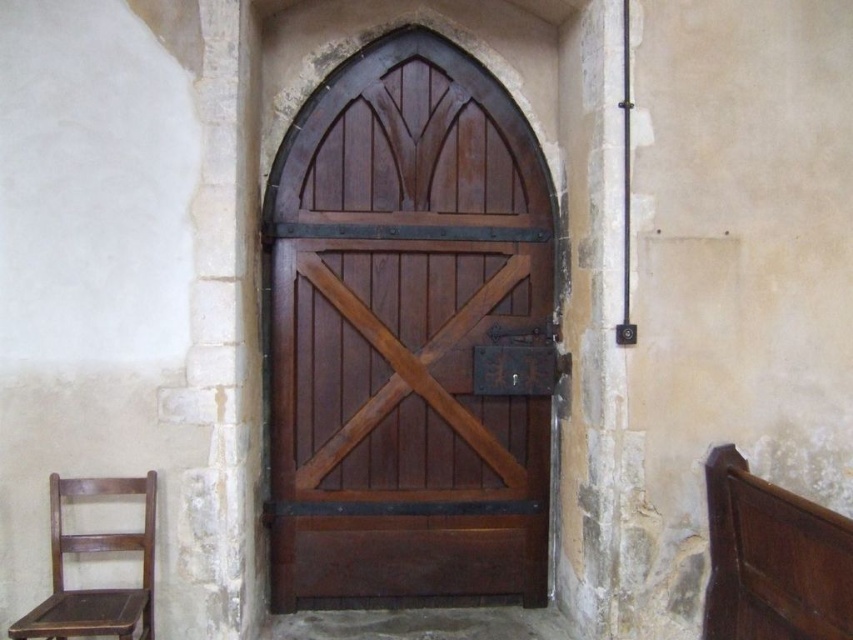
Is satin wood door at center in front of wooden chair at left?

No, it is behind wooden chair at left.

Can you confirm if satin wood door at center is positioned above wooden chair at left?

Indeed, satin wood door at center is positioned over wooden chair at left.

I want to click on satin wood door at center, so click(405, 336).